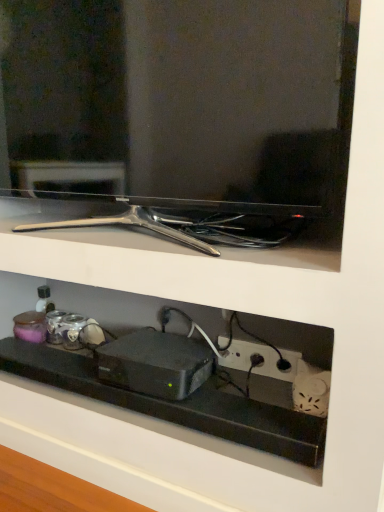
At what (x,y) coordinates should I click in order to perform the action: click on free space in front of black plastic power outlet at lower right. Please return your answer as a coordinate pair (x, y). Looking at the image, I should click on (244, 437).